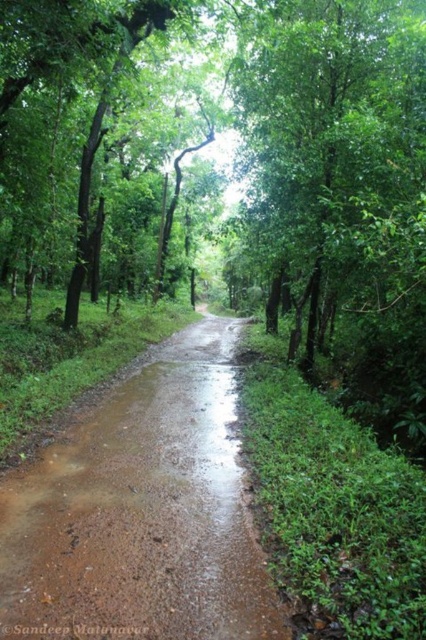
Can you confirm if brown muddy dirt track at center is taller than green leafy tree at center?

In fact, brown muddy dirt track at center may be shorter than green leafy tree at center.

Is point (239, 472) positioned before point (276, 44)?

Yes, it is in front of point (276, 44).

Is point (210, 449) behind point (336, 252)?

That is False.

Where is `brown muddy dirt track at center`? Image resolution: width=426 pixels, height=640 pixels. brown muddy dirt track at center is located at coordinates (141, 513).